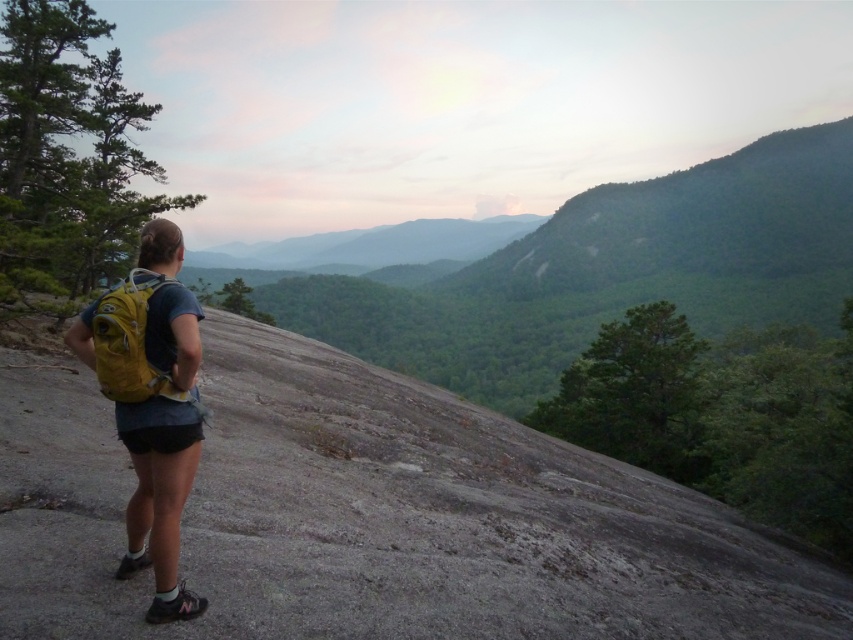
You are standing at the point labeled point (146, 385) and want to walk to the point labeled point (131, 272). Which direction should you move in relation to the camera?

You should move away from the camera because point (131, 272) is farther from the camera than point (146, 385).

You are a hiker who wants to retrieve your yellow fabric backpack at center. There is another yellow fabric backpack at left in the way. Can you reach your backpack without moving the other backpack?

The yellow fabric backpack at left is positioned under the yellow fabric backpack at center, so you can reach the yellow fabric backpack at center without moving the other backpack because it is above it.